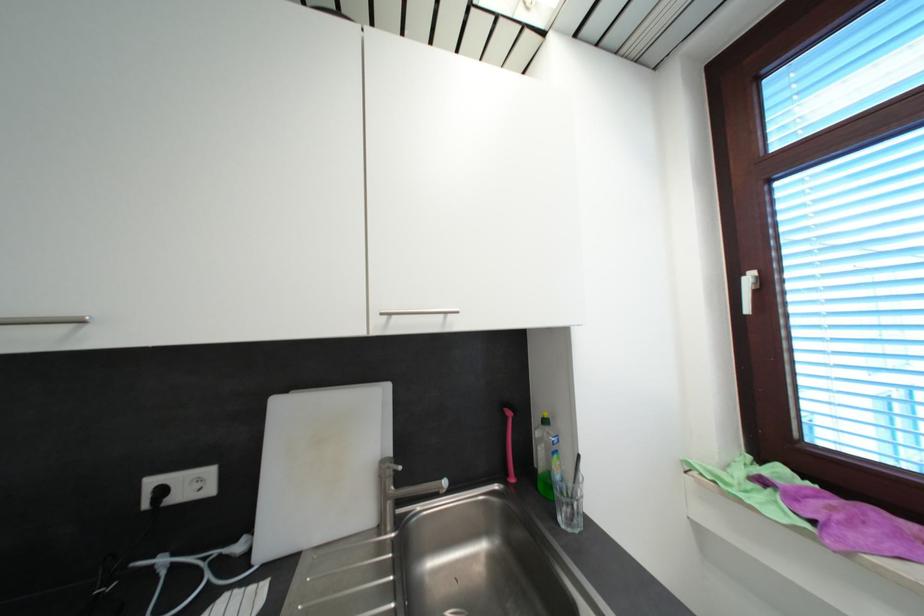
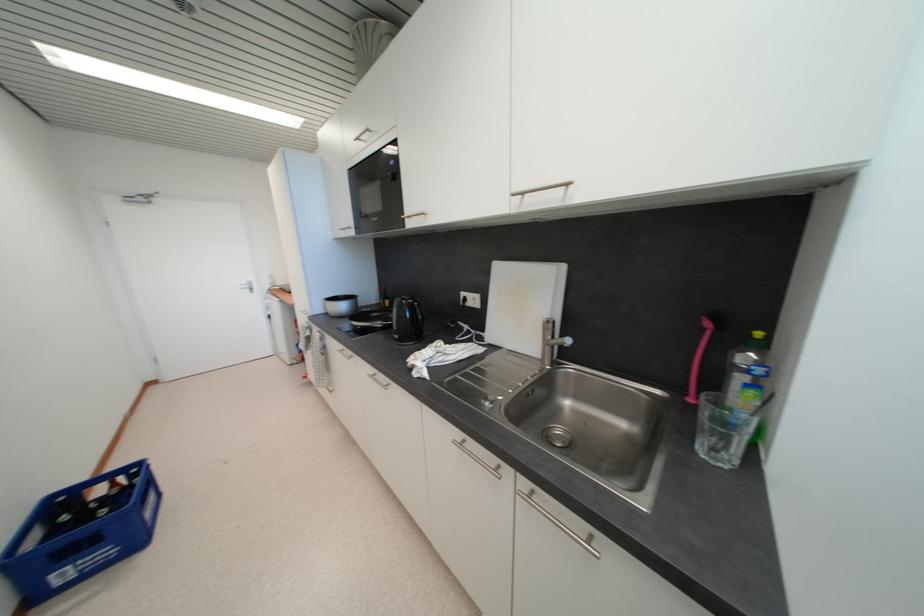
Locate, in the second image, the point that corresponds to the point at 515,416 in the first image.

(713, 326)